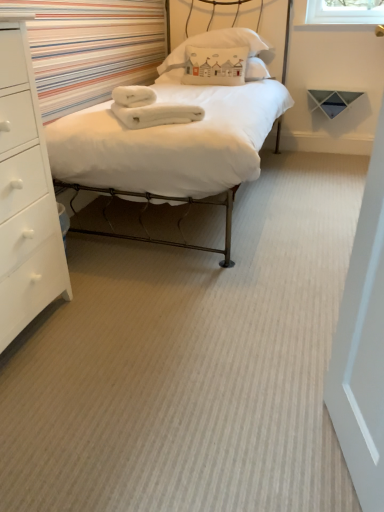
Question: Is white cotton pillow at upper center to the right of white fluffy towels at center from the viewer's perspective?

Choices:
 (A) yes
 (B) no

Answer: (A)

Question: Is white cotton pillow at upper center oriented towards white fluffy towels at center?

Choices:
 (A) no
 (B) yes

Answer: (B)

Question: Is white cotton pillow at upper center wider than white fluffy towels at center?

Choices:
 (A) yes
 (B) no

Answer: (A)

Question: From a real-world perspective, is white cotton pillow at upper center physically below white fluffy towels at center?

Choices:
 (A) yes
 (B) no

Answer: (B)

Question: Can you confirm if white cotton pillow at upper center is smaller than white fluffy towels at center?

Choices:
 (A) yes
 (B) no

Answer: (B)

Question: Looking at the image, does white cotton pillow at upper center seem bigger or smaller compared to white soft bed at center?

Choices:
 (A) small
 (B) big

Answer: (A)

Question: From a real-world perspective, is white cotton pillow at upper center physically located above or below white soft bed at center?

Choices:
 (A) above
 (B) below

Answer: (A)

Question: In the image, is white cotton pillow at upper center positioned in front of or behind white soft bed at center?

Choices:
 (A) behind
 (B) front

Answer: (A)

Question: Is white cotton pillow at upper center taller or shorter than white soft bed at center?

Choices:
 (A) short
 (B) tall

Answer: (A)

Question: Is white fluffy towels at center taller or shorter than white matte chest of drawers at left?

Choices:
 (A) short
 (B) tall

Answer: (A)

Question: From a real-world perspective, is white fluffy towels at center positioned above or below white matte chest of drawers at left?

Choices:
 (A) below
 (B) above

Answer: (B)

Question: Considering the positions of white fluffy towels at center and white matte chest of drawers at left in the image, is white fluffy towels at center wider or thinner than white matte chest of drawers at left?

Choices:
 (A) thin
 (B) wide

Answer: (A)

Question: From the image's perspective, is white fluffy towels at center located above or below white matte chest of drawers at left?

Choices:
 (A) above
 (B) below

Answer: (A)

Question: From their relative heights in the image, would you say white soft bed at center is taller or shorter than white cotton pillow at upper center?

Choices:
 (A) short
 (B) tall

Answer: (B)

Question: Considering the positions of point (72, 130) and point (248, 36), is point (72, 130) closer or farther from the camera than point (248, 36)?

Choices:
 (A) closer
 (B) farther

Answer: (A)